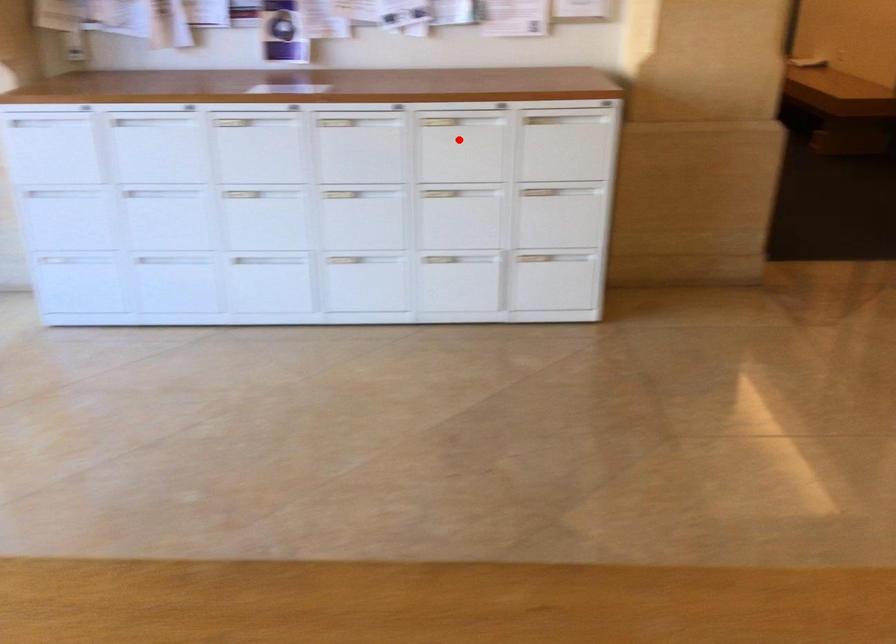
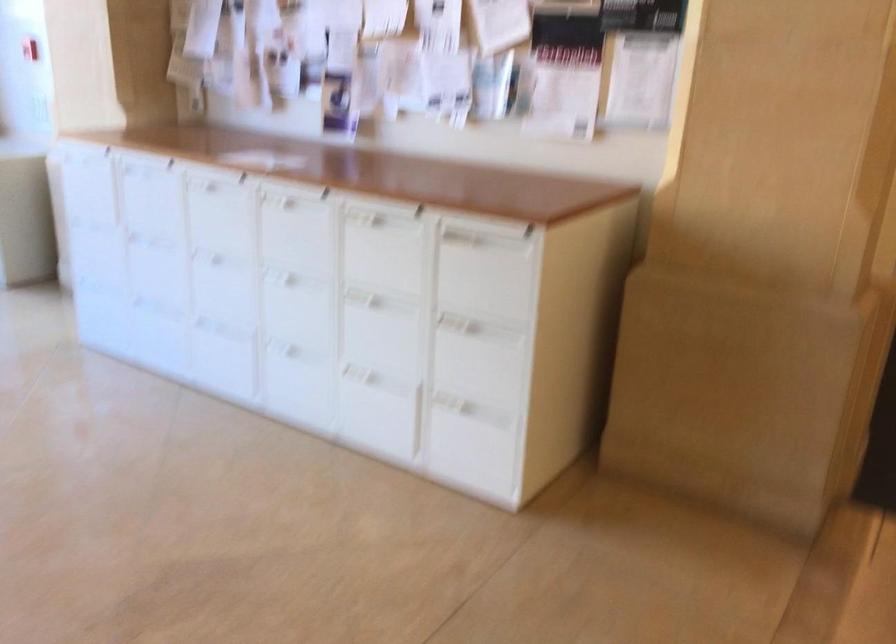
Find the pixel in the second image that matches the highlighted location in the first image.

(382, 247)